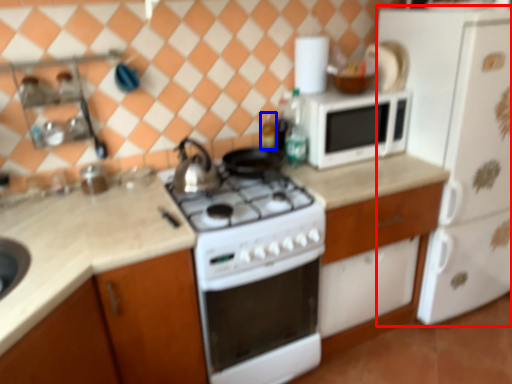
Question: Among these objects, which one is nearest to the camera, refrigerator (highlighted by a red box) or bottle (highlighted by a blue box)?

Choices:
 (A) refrigerator
 (B) bottle

Answer: (A)